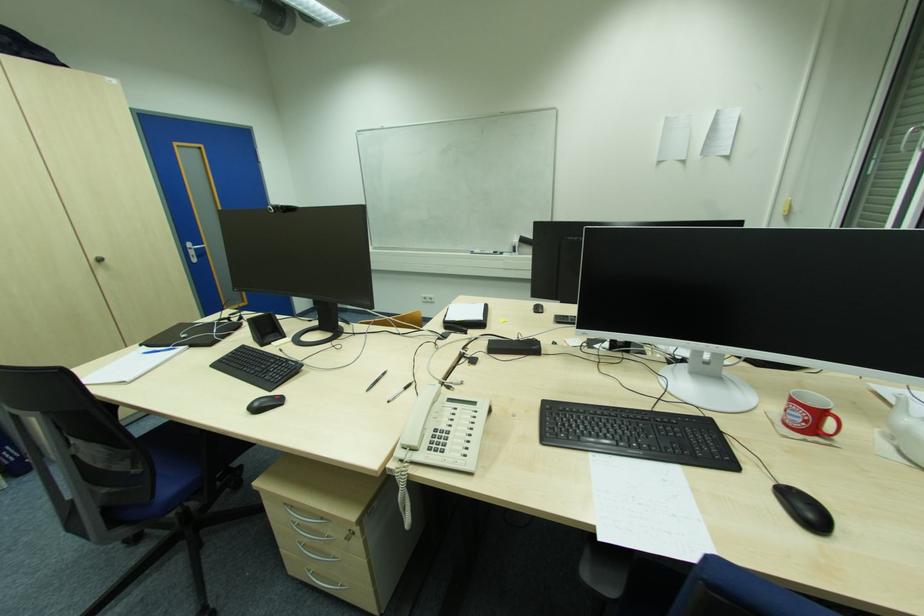
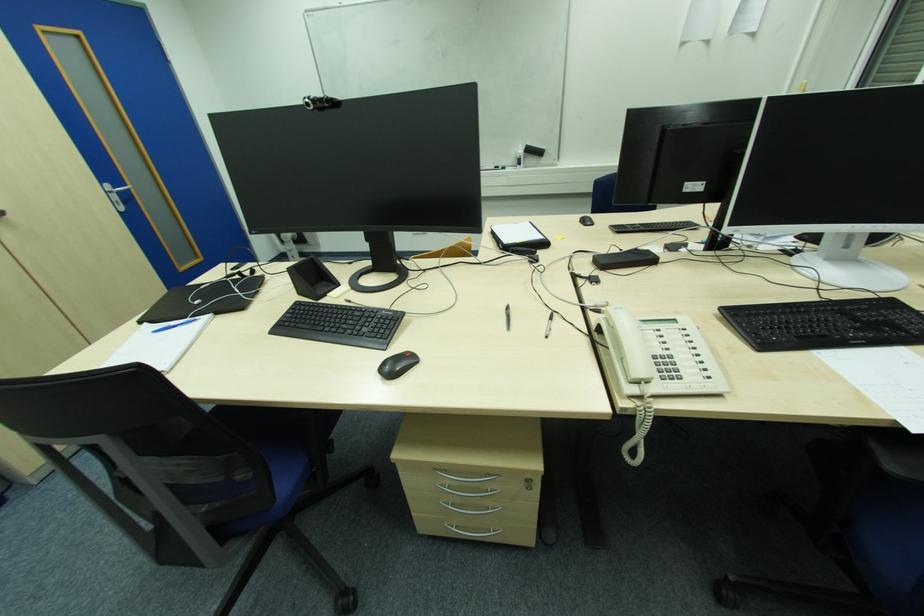
Where in the second image is the point corresponding to point 517,243 from the first image?

(521, 153)